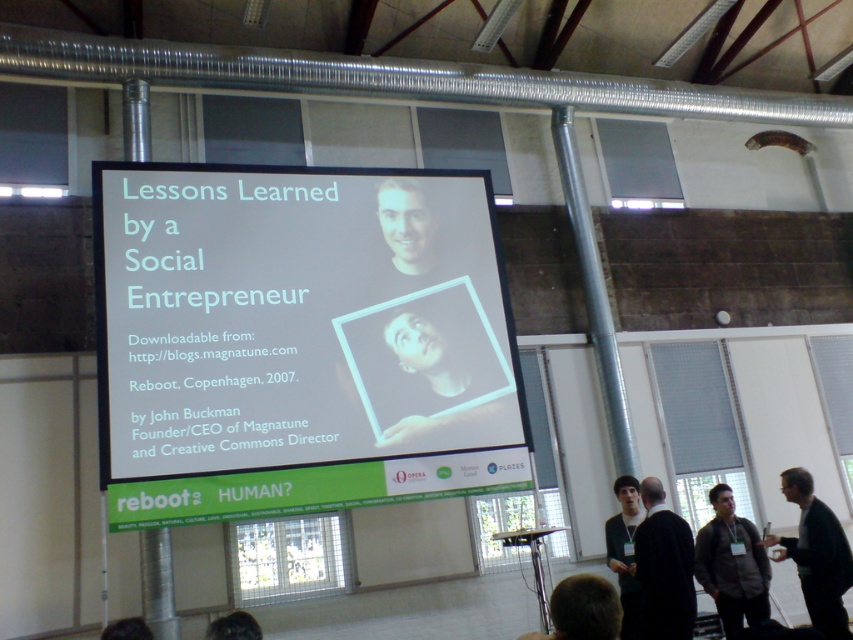
Is point (672, 557) positioned behind point (608, 534)?

No, it is not.

Who is positioned more to the right, dark gray suit at lower right or dark brown hair at lower right?

dark brown hair at lower right

Is point (677, 586) less distant than point (630, 566)?

Yes, point (677, 586) is in front of point (630, 566).

Identify the location of dark gray suit at lower right. Image resolution: width=853 pixels, height=640 pixels. (664, 566).

Is black matte jacket at lower right thinner than dark gray suit at lower right?

Yes, black matte jacket at lower right is thinner than dark gray suit at lower right.

Is black matte jacket at lower right wider than dark gray suit at lower right?

No, black matte jacket at lower right is not wider than dark gray suit at lower right.

You are a GUI agent. You are given a task and a screenshot of the screen. Output one action in this format:
    pyautogui.click(x=<x>, y=<y>)
    Task: Click on the black matte jacket at lower right
    Image resolution: width=853 pixels, height=640 pixels.
    Given the screenshot: What is the action you would take?
    pyautogui.click(x=816, y=556)

The height and width of the screenshot is (640, 853). What are the coordinates of `black matte jacket at lower right` in the screenshot? It's located at (816, 556).

At what (x,y) coordinates should I click in order to perform the action: click on white glossy projector screen at center. Please return your answer as a coordinate pair (x, y). The height and width of the screenshot is (640, 853). Looking at the image, I should click on (299, 340).